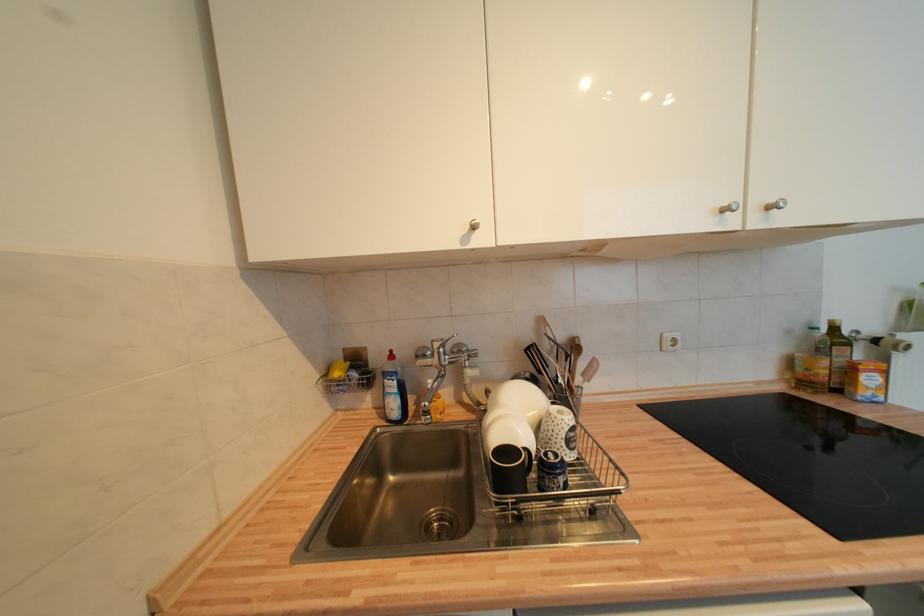
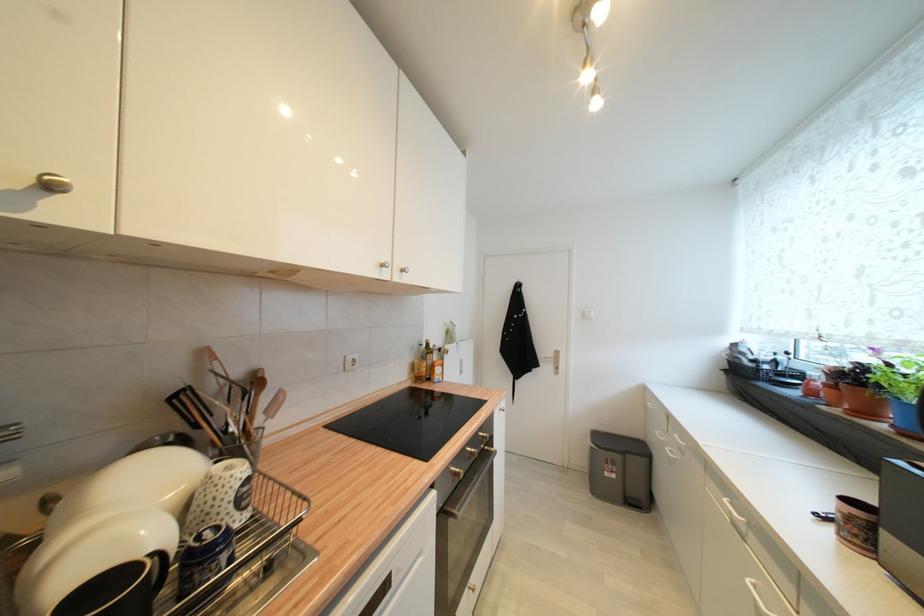
Question: The images are taken continuously from a first-person perspective. In which direction is your viewpoint rotating?

Choices:
 (A) Left
 (B) Right
 (C) Up
 (D) Down

Answer: (B)